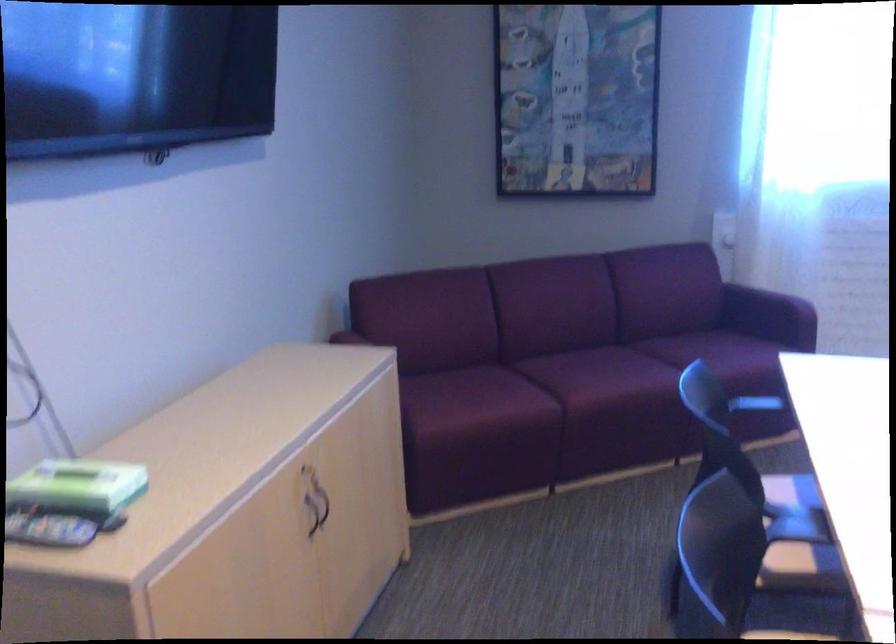
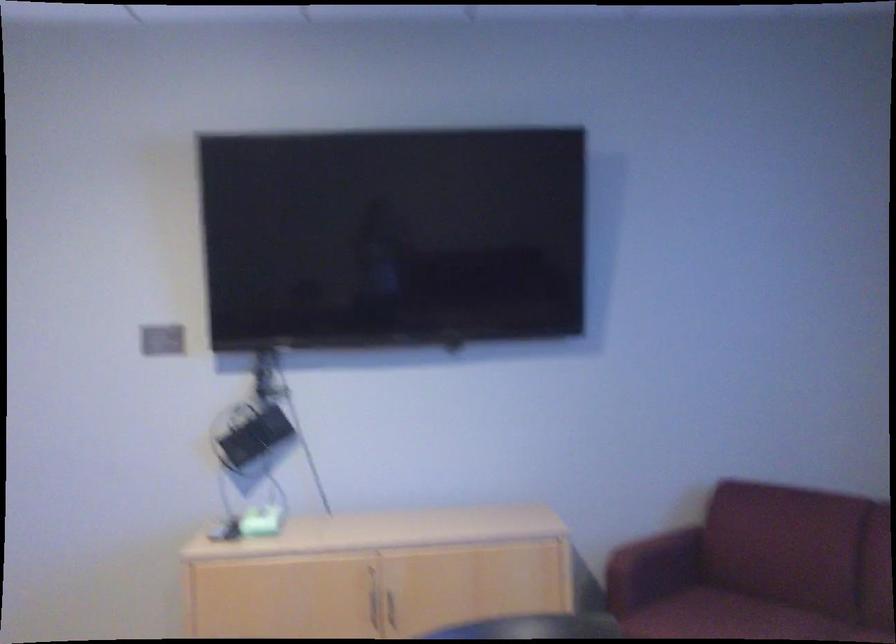
In the second image, find the point that corresponds to (311,504) in the first image.

(392, 607)